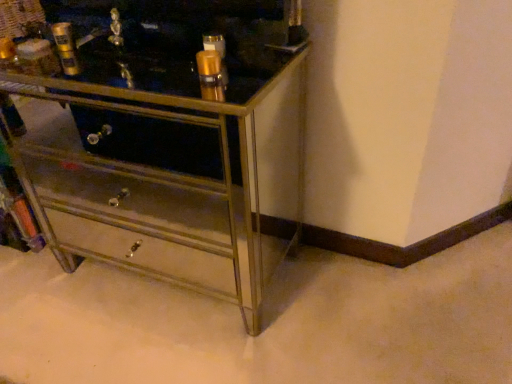
Find the location of a particular element. free space below metallic mirrored chest of drawers at center (from a real-world perspective) is located at coordinates (181, 276).